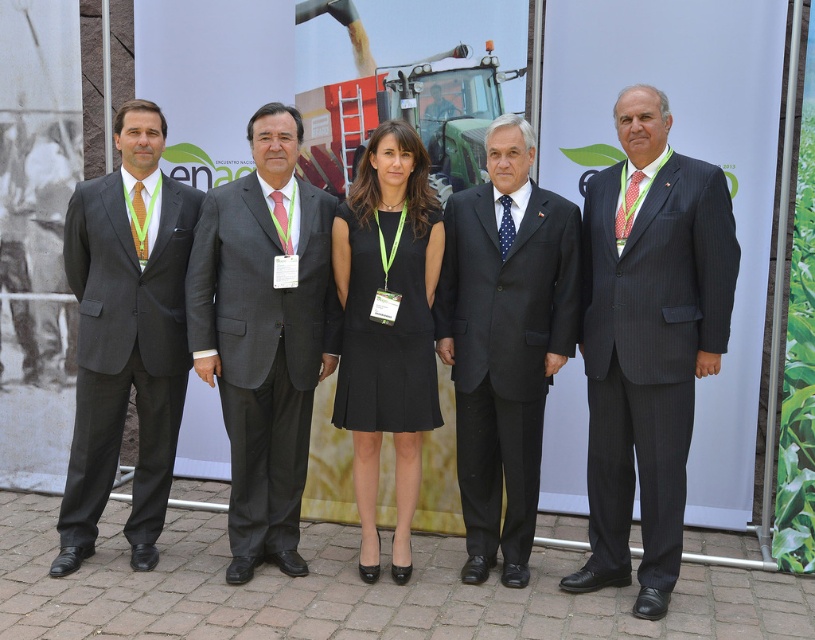
You are at coordinates 0.5, 0.3 and want to move to the dark gray suit at center. Which direction should you move to reach it?

The dark gray suit at center is located at coordinates (263, 333). Since your current position is (244, 320), you should move northeast to reach it.

You are organizing a photo shoot and need to ensure that the dark gray suit at center and the black pinstripe suit at center are visible in the frame. Given that the camera has a limited field of view, which suit might require more space to be fully captured?

The dark gray suit at center is bigger than the black pinstripe suit at center, so it would require more space to be fully captured in the frame.